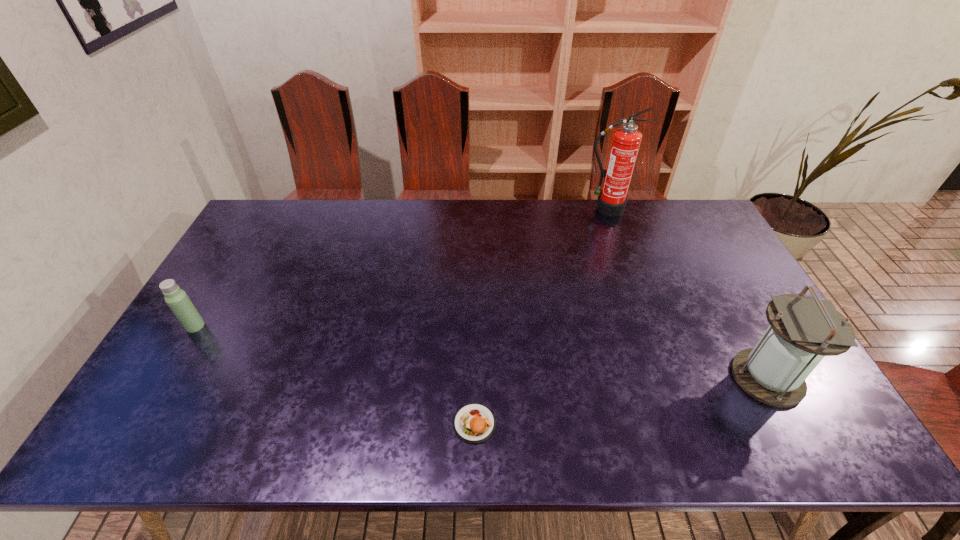
The width and height of the screenshot is (960, 540). In order to click on the second object from right to left in this screenshot , I will do `click(626, 140)`.

At what (x,y) coordinates should I click in order to perform the action: click on the farthest object. Please return your answer as a coordinate pair (x, y). This screenshot has height=540, width=960. Looking at the image, I should click on (626, 140).

In order to click on the second tallest object in this screenshot , I will do `click(803, 330)`.

Where is `the rightmost object`? The image size is (960, 540). the rightmost object is located at coordinates (803, 330).

Locate an element on the screen. The height and width of the screenshot is (540, 960). the third nearest object is located at coordinates (177, 299).

The width and height of the screenshot is (960, 540). In order to click on the second shortest object in this screenshot , I will do `click(177, 299)`.

You are a GUI agent. You are given a task and a screenshot of the screen. Output one action in this format:
    pyautogui.click(x=<x>, y=<y>)
    Task: Click on the third object from right to left
    The width and height of the screenshot is (960, 540).
    Given the screenshot: What is the action you would take?
    pyautogui.click(x=474, y=423)

Image resolution: width=960 pixels, height=540 pixels. In order to click on patty (food) in this screenshot , I will do (x=474, y=423).

Find the location of a particular element. The image size is (960, 540). free location located on the front-facing side of the tallest object is located at coordinates (615, 240).

I want to click on vacant area located on the left of the second tallest object, so click(x=675, y=378).